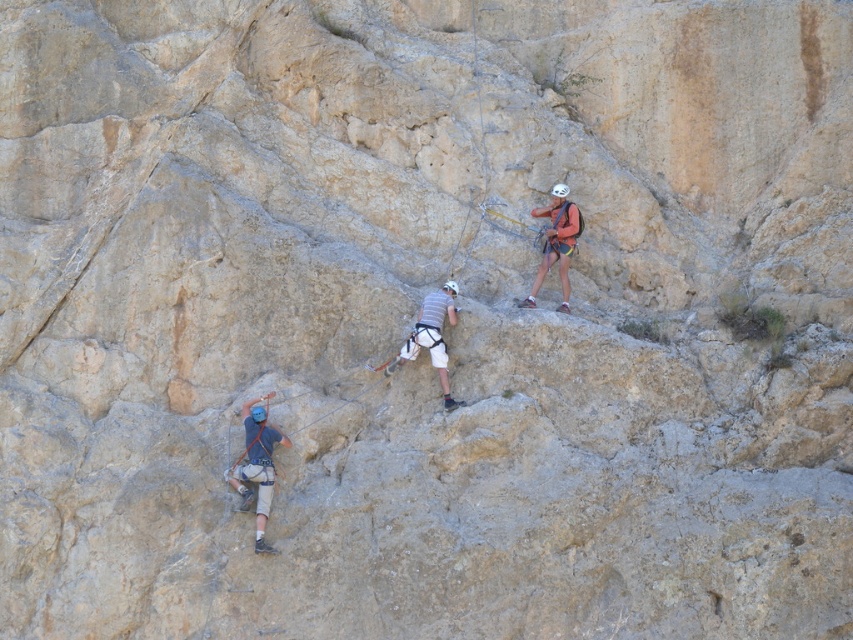
Question: Is blue matte climbing harness at lower left thinner than orange fabric harness at upper right?

Choices:
 (A) no
 (B) yes

Answer: (B)

Question: Which is farther from the blue matte climbing harness at lower left?

Choices:
 (A) orange fabric harness at upper right
 (B) white matte climbing harness at center

Answer: (A)

Question: Which point appears closest to the camera in this image?

Choices:
 (A) (253, 397)
 (B) (550, 250)

Answer: (A)

Question: Is blue matte climbing harness at lower left further to the viewer compared to white matte climbing harness at center?

Choices:
 (A) yes
 (B) no

Answer: (B)

Question: Is blue matte climbing harness at lower left bigger than orange fabric harness at upper right?

Choices:
 (A) no
 (B) yes

Answer: (B)

Question: Which of the following is the closest to the observer?

Choices:
 (A) (405, 346)
 (B) (242, 413)
 (C) (558, 237)

Answer: (B)